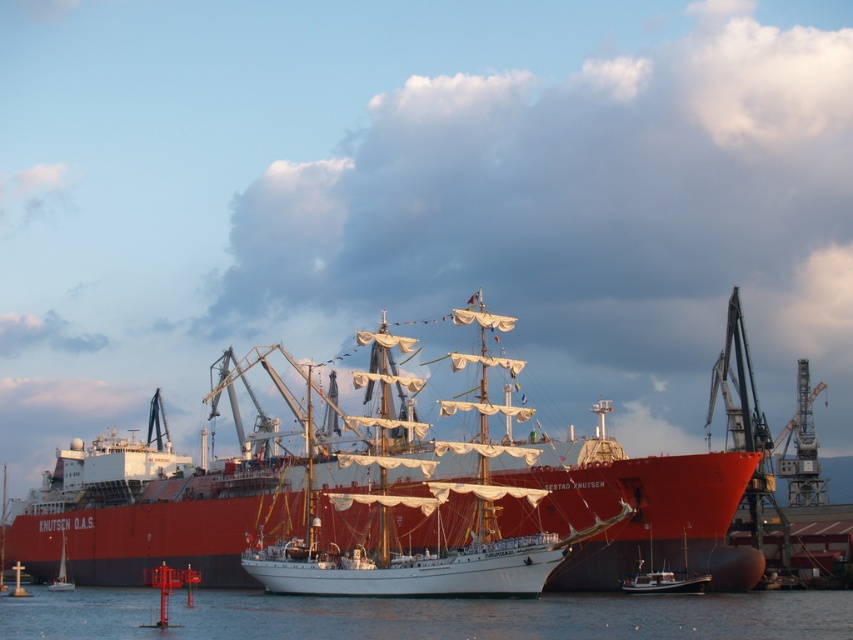
From the picture: You are a sailor who wants to determine which boat is taller between the smooth white sailboat at center and the white sailboat at lower left. Based on the scene, which one is taller?

The smooth white sailboat at center is taller than the white sailboat at lower left.

Looking at this image, you are a sailor who needs to navigate your boat through the transparent water at lower center. The white wooden boat at lower right is blocking your path. Can you safely pass under it?

The transparent water at lower center is taller than the white wooden boat at lower right, so you can safely pass under the white wooden boat at lower right.

You are standing on the dock and see both the smooth white sailboat at center and the white sailboat at lower left. Which one is nearer to you?

The smooth white sailboat at center is closer to the viewer than the white sailboat at lower left, so the smooth white sailboat at center is nearer to you.